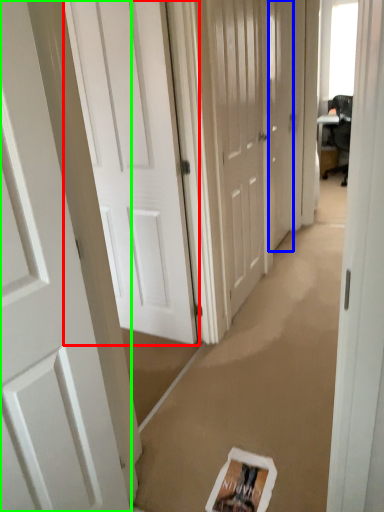
Question: Estimate the real-world distances between objects in this image. Which object is farther from door (highlighted by a red box), door (highlighted by a blue box) or door (highlighted by a green box)?

Choices:
 (A) door
 (B) door

Answer: (A)